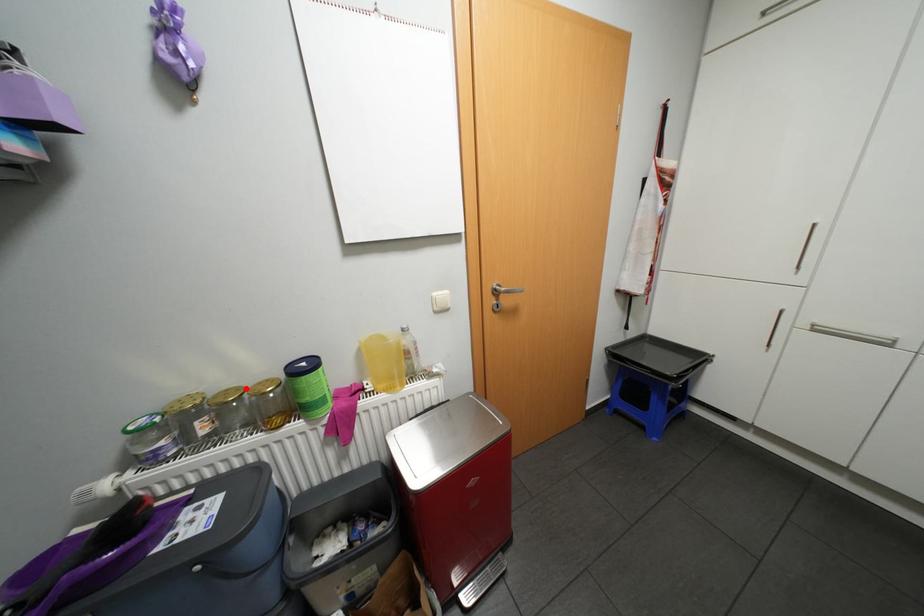
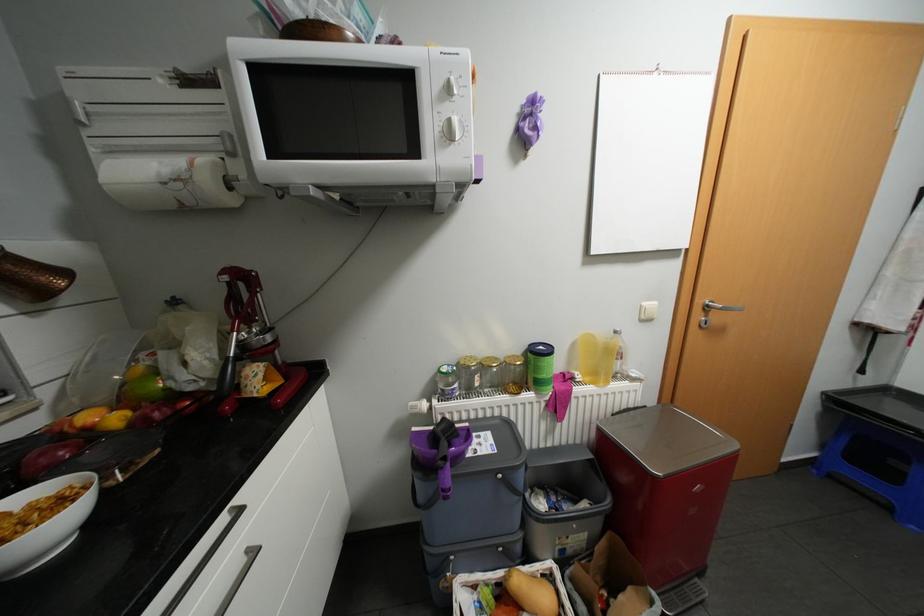
In the second image, find the point that corresponds to the highlighted location in the first image.

(504, 358)